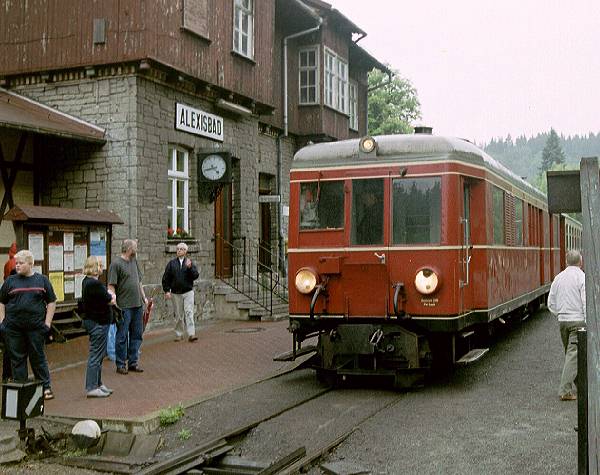
The width and height of the screenshot is (600, 475). Find the location of `clock`. clock is located at coordinates (216, 161).